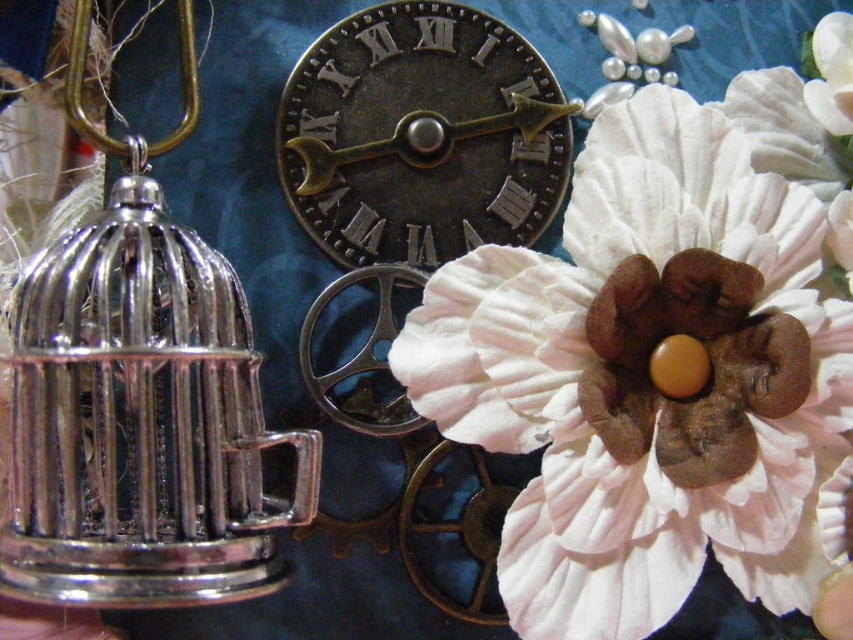
Question: Does white fabric flower at upper right have a smaller size compared to antique brass clock at center?

Choices:
 (A) no
 (B) yes

Answer: (A)

Question: Is white fabric flower at upper right thinner than antique brass clock at center?

Choices:
 (A) no
 (B) yes

Answer: (A)

Question: Which of the following is the farthest from the observer?

Choices:
 (A) (599, 209)
 (B) (392, 49)

Answer: (B)

Question: Which point is closer to the camera?

Choices:
 (A) (537, 156)
 (B) (454, 307)

Answer: (B)

Question: In this image, where is white fabric flower at upper right located relative to antique brass clock at center?

Choices:
 (A) left
 (B) right

Answer: (B)